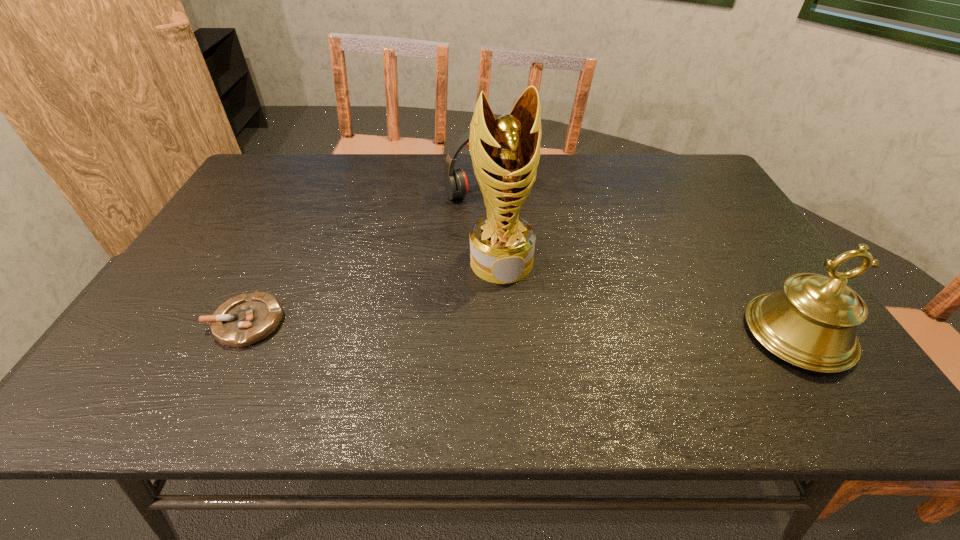
Identify the location of the leftmost object. The width and height of the screenshot is (960, 540). (246, 319).

The image size is (960, 540). In order to click on ashtray in this screenshot , I will do `click(246, 319)`.

Identify the location of the second tallest object. (811, 323).

This screenshot has width=960, height=540. Identify the location of bell. (811, 323).

This screenshot has width=960, height=540. In order to click on the second shortest object in this screenshot , I will do `click(455, 180)`.

The height and width of the screenshot is (540, 960). In order to click on earphone in this screenshot , I will do `click(455, 180)`.

I want to click on the tallest object, so click(x=505, y=152).

I want to click on the second farthest object, so click(505, 152).

Image resolution: width=960 pixels, height=540 pixels. What are the coordinates of `vacant region located 0.120m on the back of the leftmost object` in the screenshot? It's located at (276, 264).

At what (x,y) coordinates should I click in order to perform the action: click on vacant space situated on the back of the third shortest object. Please return your answer as a coordinate pair (x, y). The image size is (960, 540). Looking at the image, I should click on (732, 232).